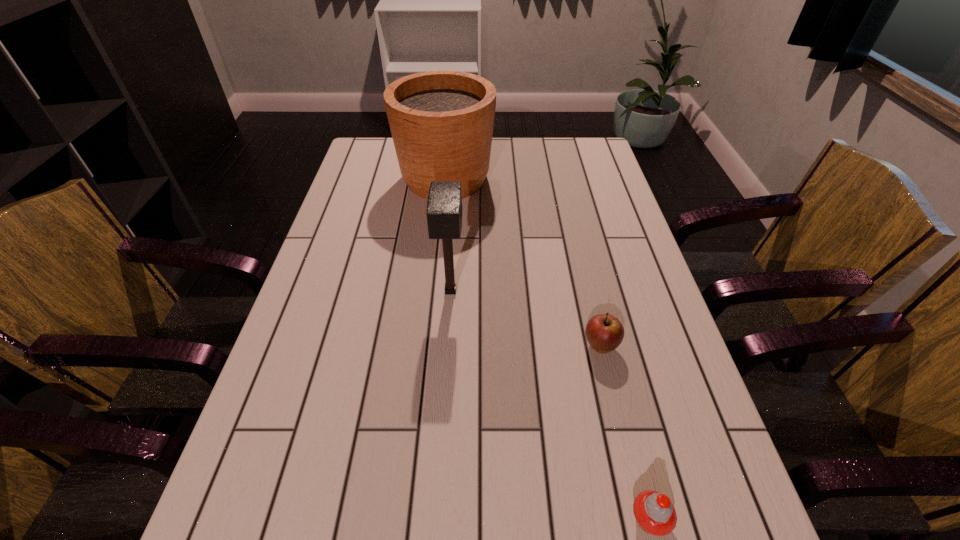
The width and height of the screenshot is (960, 540). I want to click on flowerpot, so click(x=441, y=122).

Identify the location of the second farthest object. (444, 204).

Identify the location of apple. (604, 332).

At what (x,y) coordinates should I click in order to perform the action: click on blank space located 0.370m on the right of the farthest object. Please return your answer as a coordinate pair (x, y). Looking at the image, I should click on (606, 179).

Identify the location of vacant space located 0.250m on the back of the mallet. (455, 215).

The image size is (960, 540). What are the coordinates of `free space located 0.230m on the back of the second nearest object` in the screenshot? It's located at (581, 264).

The width and height of the screenshot is (960, 540). I want to click on object present at the far edge, so click(441, 122).

Identify the location of object present at the left edge. Image resolution: width=960 pixels, height=540 pixels. (441, 122).

Find the location of `object situated at the right edge`. object situated at the right edge is located at coordinates pyautogui.click(x=604, y=332).

The image size is (960, 540). In order to click on object that is at the far left corner in this screenshot , I will do `click(441, 122)`.